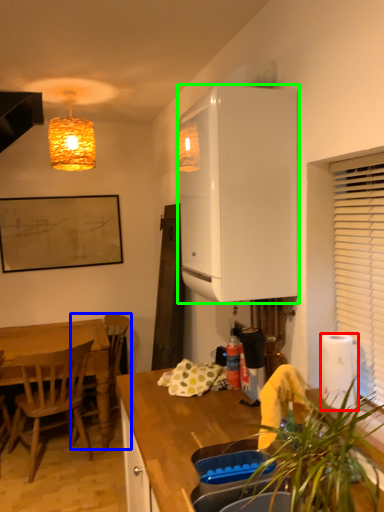
Question: Which object is positioned farthest from paper towel (highlighted by a red box)? Select from chair (highlighted by a blue box) and cabinetry (highlighted by a green box).

Choices:
 (A) chair
 (B) cabinetry

Answer: (A)